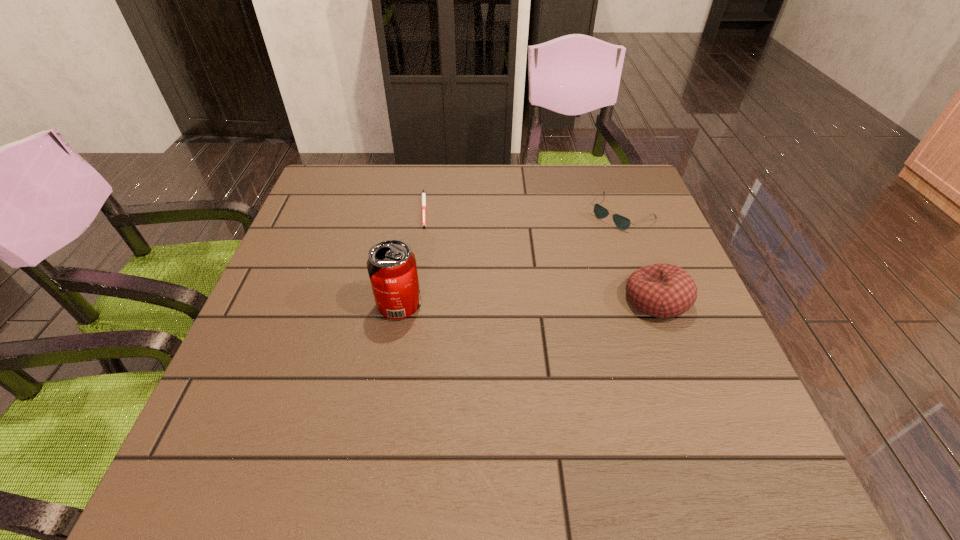
Identify the location of free space on the desktop that is between the soda can and the third shortest object and is positioned on the lenses of the third tallest object. (512, 303).

The image size is (960, 540). What are the coordinates of `free space on the desktop that is between the soda can and the second tallest object and is positioned on the clicker of the shortest object` in the screenshot? It's located at (528, 302).